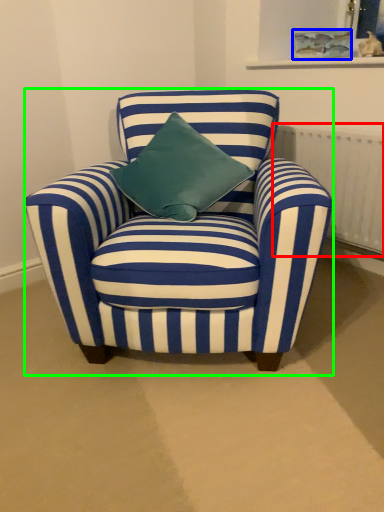
Question: Which object is positioned closest to radiator (highlighted by a red box)? Select from picture frame (highlighted by a blue box) and chair (highlighted by a green box).

Choices:
 (A) picture frame
 (B) chair

Answer: (A)